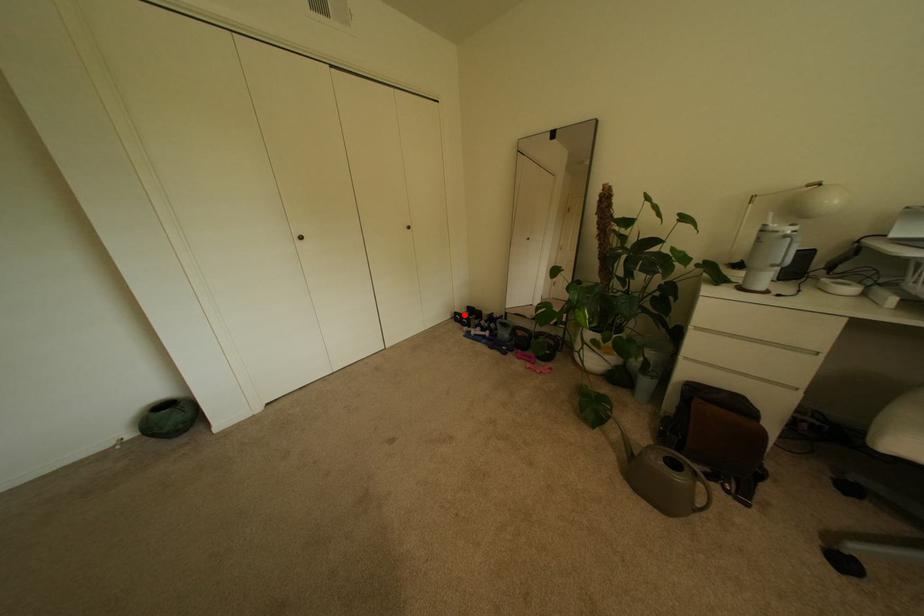
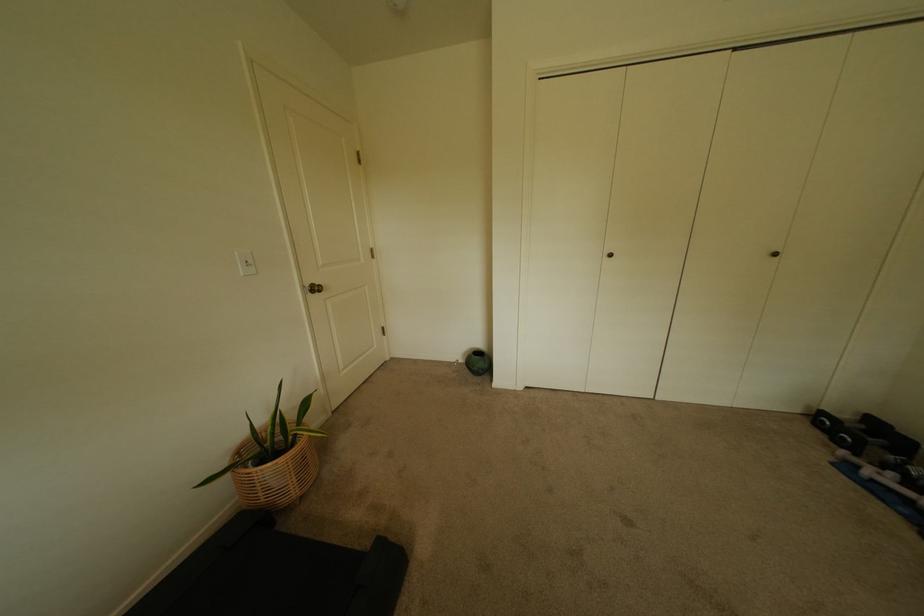
Where in the second image is the point corresponding to the highlighted location from the first image?

(831, 415)